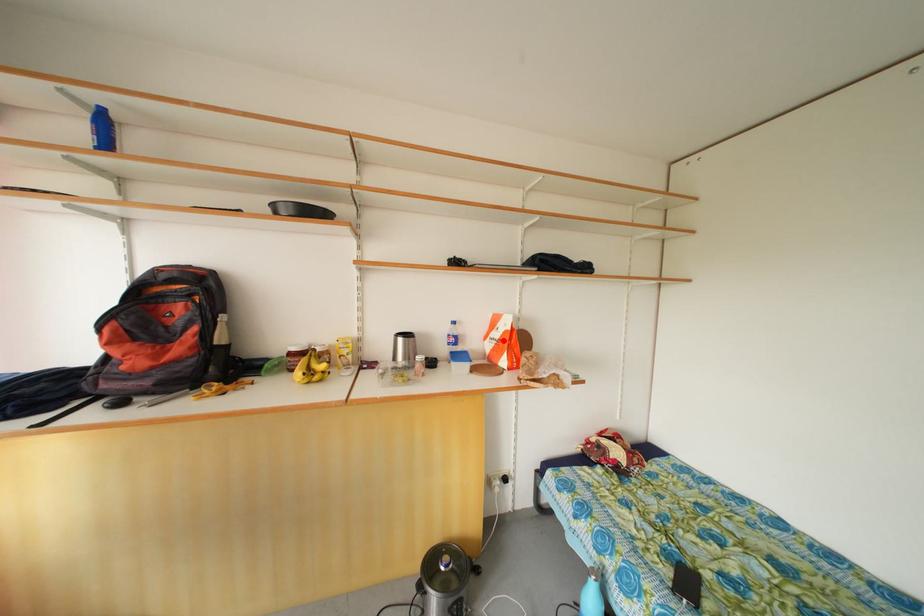
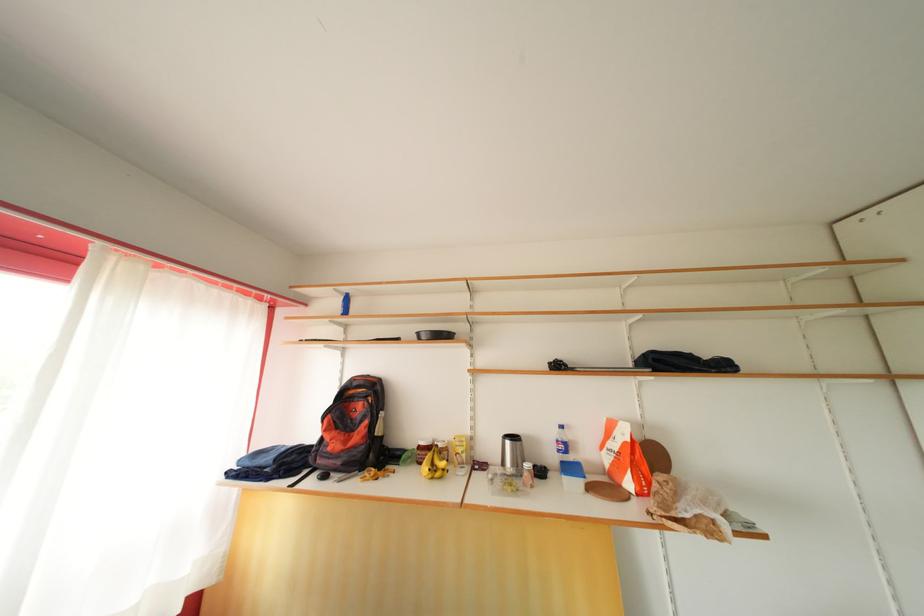
Where in the second image is the point corresponding to the highlighted location from the first image?

(622, 451)